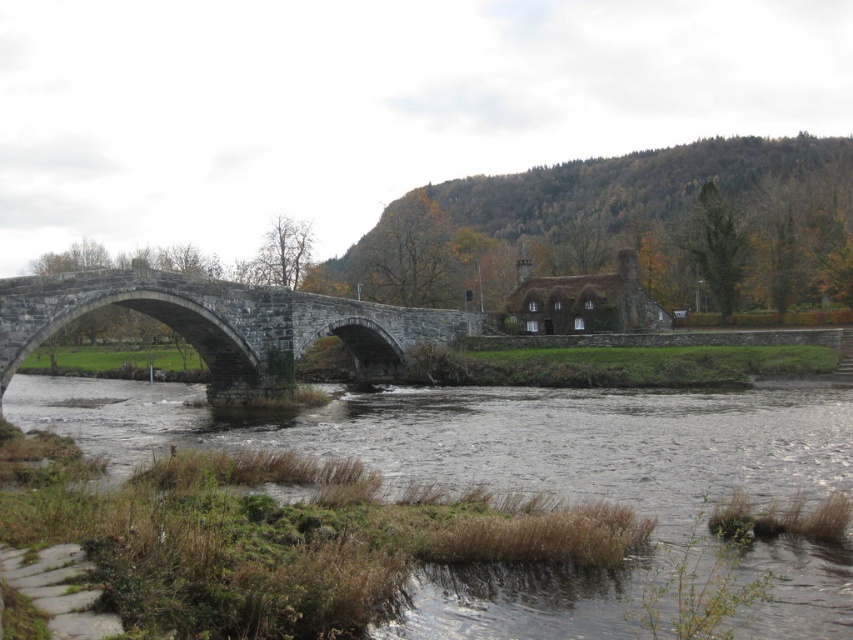
You are standing on the stone bridge at center and want to get to the brown grassy river at lower left. Which direction should you walk to reach it?

To reach the brown grassy river at lower left from the stone bridge at center, you should walk to the left since the brown grassy river at lower left is located to the right of the stone bridge at center.

You are a hiker planning to cross the stone bridge at center over the brown grassy river at lower left. Considering the width of the bridge and the river, which one is wider?

The brown grassy river at lower left is wider than the stone bridge at center according to the description.

You are standing on the stone bridge and want to cross to the other side where the building with the reddish brown roof is located. There are two points marked on the bridge. One is at coordinates point (688, 429) and the other at point (51, 326). Which point should you walk towards to reach the building faster?

You should walk towards point (51, 326) because it is closer to the building with the reddish brown roof than point (688, 429), which is further away.